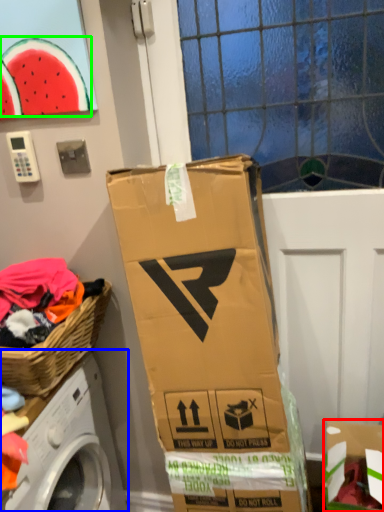
Question: Which object is the farthest from cardboard box (highlighted by a red box)? Choose among these: washing machine (highlighted by a blue box) or watermelon (highlighted by a green box).

Choices:
 (A) washing machine
 (B) watermelon

Answer: (B)